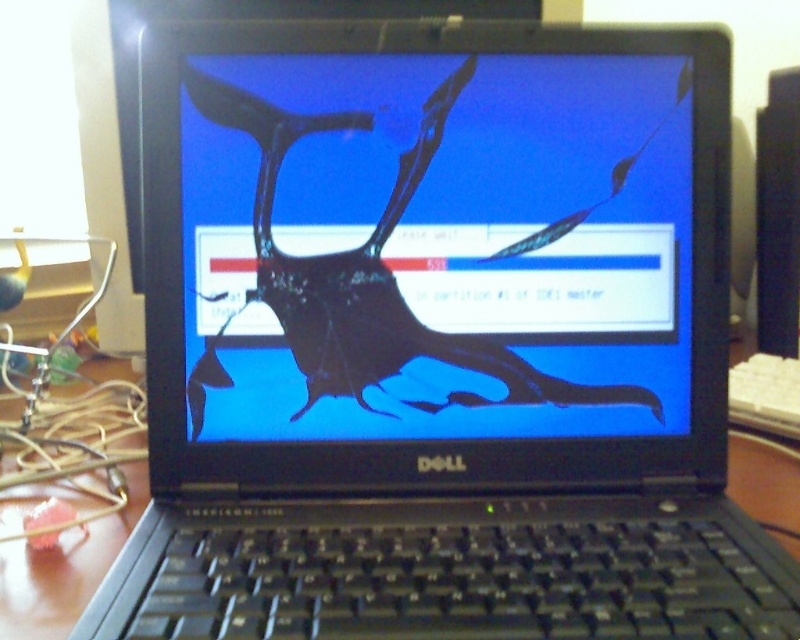
Question: Is the position of transparent glass screen at center more distant than that of wooden table at center?

Choices:
 (A) no
 (B) yes

Answer: (B)

Question: Is transparent glass screen at center above wooden table at center?

Choices:
 (A) yes
 (B) no

Answer: (A)

Question: Which point is farther to the camera?

Choices:
 (A) transparent glass screen at center
 (B) wooden table at center

Answer: (A)

Question: Which of the following is the closest to the observer?

Choices:
 (A) pos(270,240)
 (B) pos(92,561)

Answer: (A)

Question: Does transparent glass screen at center have a smaller size compared to wooden table at center?

Choices:
 (A) yes
 (B) no

Answer: (A)